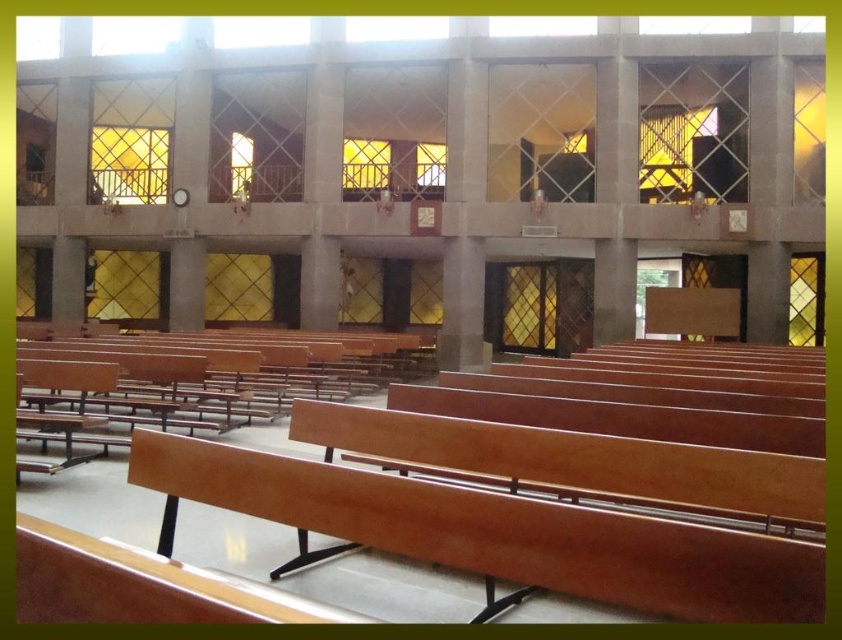
You are a maintenance worker in the church. You need to move a 3.0 meters long ladder from the entrance to the back pew. The ladder is too long to carry upright. There is a narrow corridor between the wooden church bench at center and wooden bench at center. Can the ladder fit through the corridor?

The wooden church bench at center and wooden bench at center are 3.02 meters apart from each other. The ladder is 3.0 meters long. Since the distance between the benches is slightly larger than the ladder, the ladder can fit through the corridor if placed horizontally.

You are an architect designing a new seating arrangement for the wooden church bench at center and the wooden bench at center. Which bench should you place higher to ensure proper visibility for both sections?

The wooden church bench at center should be placed higher than the wooden bench at center to ensure proper visibility since it is taller.

You are standing in the middle of the building and see two wooden benches. One is labeled as the wooden church bench at center, and the other is the wooden bench at center. Which one is positioned to the right of the other?

The wooden church bench at center is positioned to the right of the wooden bench at center.